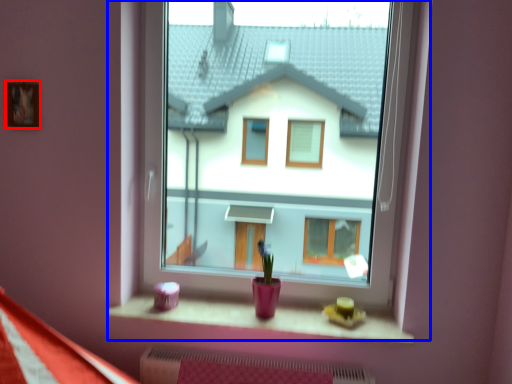
Question: Among these objects, which one is nearest to the camera, picture frame (highlighted by a red box) or window (highlighted by a blue box)?

Choices:
 (A) picture frame
 (B) window

Answer: (B)